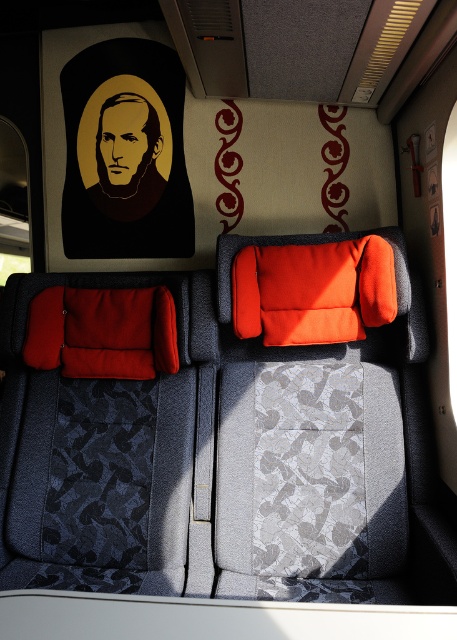
Is point (311, 314) positioned before point (112, 310)?

Yes, point (311, 314) is closer to viewer.

Looking at this image, is orange fabric pillow at center smaller than velvet red pillow at left?

No.

I want to click on orange fabric pillow at center, so click(x=313, y=291).

You are a GUI agent. You are given a task and a screenshot of the screen. Output one action in this format:
    pyautogui.click(x=<x>, y=<y>)
    Task: Click on the orange fabric pillow at center
    Image resolution: width=457 pixels, height=640 pixels.
    Given the screenshot: What is the action you would take?
    pyautogui.click(x=313, y=291)